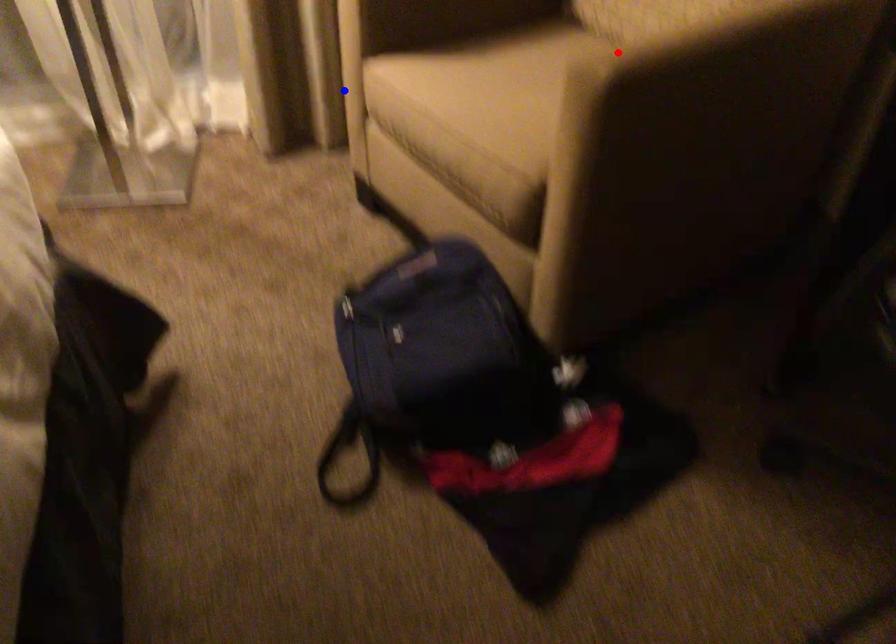
Question: Which of the two points in the image is closer to the camera?

Choices:
 (A) Blue point is closer.
 (B) Red point is closer.

Answer: (B)